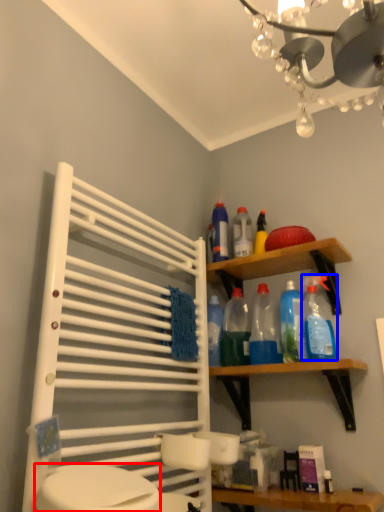
Question: Which point is further to the camera, toilet bowl (highlighted by a red box) or cleaning product (highlighted by a blue box)?

Choices:
 (A) toilet bowl
 (B) cleaning product

Answer: (B)